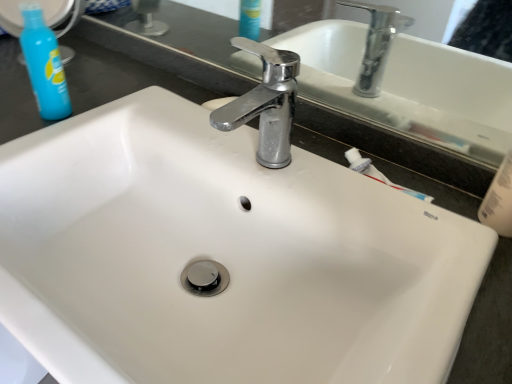
Question: In the image, is chrome metallic faucet at center on the left side or the right side of blue plastic bottle at upper left?

Choices:
 (A) right
 (B) left

Answer: (A)

Question: From the image's perspective, is chrome metallic faucet at center located above or below blue plastic bottle at upper left?

Choices:
 (A) above
 (B) below

Answer: (B)

Question: In terms of height, does chrome metallic faucet at center look taller or shorter compared to blue plastic bottle at upper left?

Choices:
 (A) tall
 (B) short

Answer: (B)

Question: Visually, is blue plastic bottle at upper left positioned to the left or to the right of chrome metallic faucet at center?

Choices:
 (A) right
 (B) left

Answer: (B)

Question: From the image's perspective, is blue plastic bottle at upper left positioned above or below chrome metallic faucet at center?

Choices:
 (A) below
 (B) above

Answer: (B)

Question: Which is correct: blue plastic bottle at upper left is inside chrome metallic faucet at center, or outside of it?

Choices:
 (A) inside
 (B) outside

Answer: (B)

Question: Is blue plastic bottle at upper left in front of or behind chrome metallic faucet at center in the image?

Choices:
 (A) behind
 (B) front

Answer: (A)